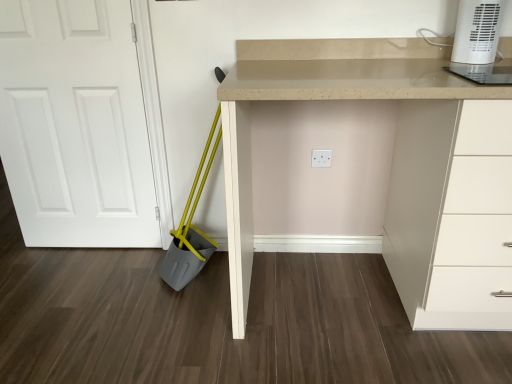
Question: Can you confirm if beige laminate desk at center is bigger than white plastic heater at upper right?

Choices:
 (A) no
 (B) yes

Answer: (B)

Question: Is beige laminate desk at center wider than white plastic heater at upper right?

Choices:
 (A) yes
 (B) no

Answer: (A)

Question: Is beige laminate desk at center to the left of white plastic heater at upper right from the viewer's perspective?

Choices:
 (A) no
 (B) yes

Answer: (B)

Question: Can you confirm if beige laminate desk at center is taller than white plastic heater at upper right?

Choices:
 (A) yes
 (B) no

Answer: (A)

Question: From a real-world perspective, is beige laminate desk at center located higher than white plastic heater at upper right?

Choices:
 (A) yes
 (B) no

Answer: (B)

Question: Does point (500, 4) appear closer or farther from the camera than point (250, 195)?

Choices:
 (A) farther
 (B) closer

Answer: (B)

Question: Is white plastic heater at upper right taller or shorter than beige laminate desk at center?

Choices:
 (A) tall
 (B) short

Answer: (B)

Question: In the image, is white plastic heater at upper right positioned in front of or behind beige laminate desk at center?

Choices:
 (A) behind
 (B) front

Answer: (A)

Question: From the image's perspective, is white plastic heater at upper right above or below beige laminate desk at center?

Choices:
 (A) below
 (B) above

Answer: (B)

Question: Is beige laminate desk at center taller or shorter than white matte door at left?

Choices:
 (A) short
 (B) tall

Answer: (A)

Question: Is beige laminate desk at center in front of or behind white matte door at left in the image?

Choices:
 (A) front
 (B) behind

Answer: (A)

Question: Looking at their shapes, would you say beige laminate desk at center is wider or thinner than white matte door at left?

Choices:
 (A) thin
 (B) wide

Answer: (B)

Question: Is point (244, 51) positioned closer to the camera than point (53, 82)?

Choices:
 (A) farther
 (B) closer

Answer: (B)

Question: From the image's perspective, relative to white plastic heater at upper right, is white matte door at left above or below?

Choices:
 (A) below
 (B) above

Answer: (A)

Question: Is white matte door at left inside or outside of white plastic heater at upper right?

Choices:
 (A) outside
 (B) inside

Answer: (A)